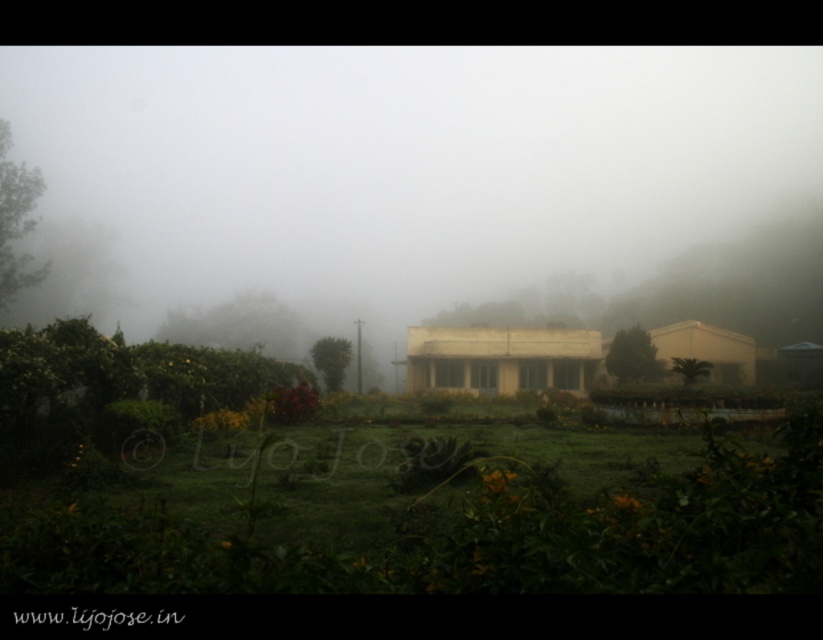
Question: Based on their relative distances, which object is nearer to the foggy white building at center?

Choices:
 (A) white concrete building at center
 (B) matte yellow building at center

Answer: (A)

Question: Does white concrete building at center appear on the right side of matte yellow building at center?

Choices:
 (A) no
 (B) yes

Answer: (A)

Question: Is white concrete building at center positioned at the back of matte yellow building at center?

Choices:
 (A) yes
 (B) no

Answer: (A)

Question: Which object appears farthest from the camera in this image?

Choices:
 (A) white concrete building at center
 (B) matte yellow building at center

Answer: (A)

Question: Is white concrete building at center below matte yellow building at center?

Choices:
 (A) no
 (B) yes

Answer: (B)

Question: Which object appears closest to the camera in this image?

Choices:
 (A) matte yellow building at center
 (B) foggy white building at center

Answer: (A)